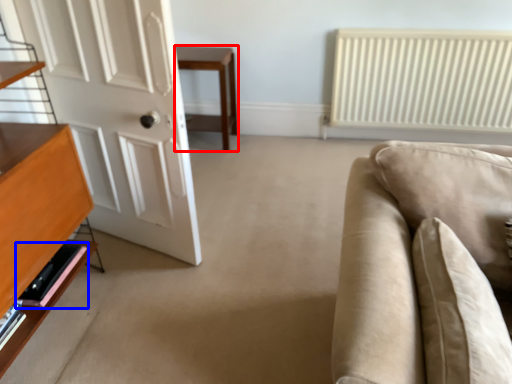
Question: Which point is closer to the camera, table (highlighted by a red box) or shelf (highlighted by a blue box)?

Choices:
 (A) table
 (B) shelf

Answer: (B)